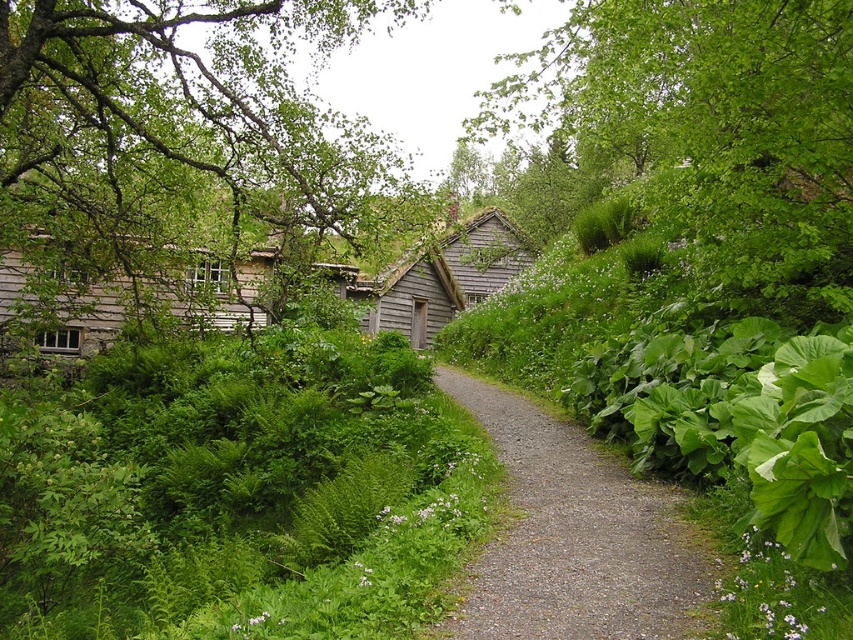
Question: Which point is closer to the camera taking this photo?

Choices:
 (A) (468, 275)
 (B) (733, 272)
 (C) (115, 40)
 (D) (631, 497)

Answer: (D)

Question: Does green leafy tree at left have a lesser width compared to green leafy tree at upper center?

Choices:
 (A) yes
 (B) no

Answer: (B)

Question: Estimate the real-world distances between objects in this image. Which object is closer to the wooden shingles cabin at center?

Choices:
 (A) green leafy tree at left
 (B) green leafy tree at upper center

Answer: (B)

Question: Is green leafy tree at left positioned at the back of gray gravel path at center?

Choices:
 (A) yes
 (B) no

Answer: (A)

Question: Which object appears closest to the camera in this image?

Choices:
 (A) green leafy tree at left
 (B) green leafy tree at upper center
 (C) wooden shingles cabin at center

Answer: (B)

Question: Is green leafy tree at left to the left of wooden shingles cabin at center from the viewer's perspective?

Choices:
 (A) yes
 (B) no

Answer: (A)